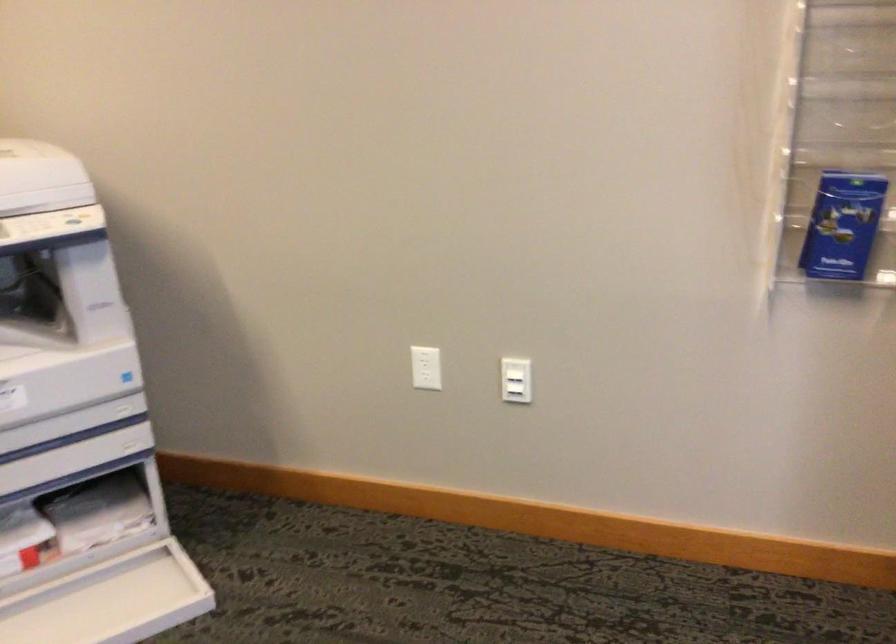
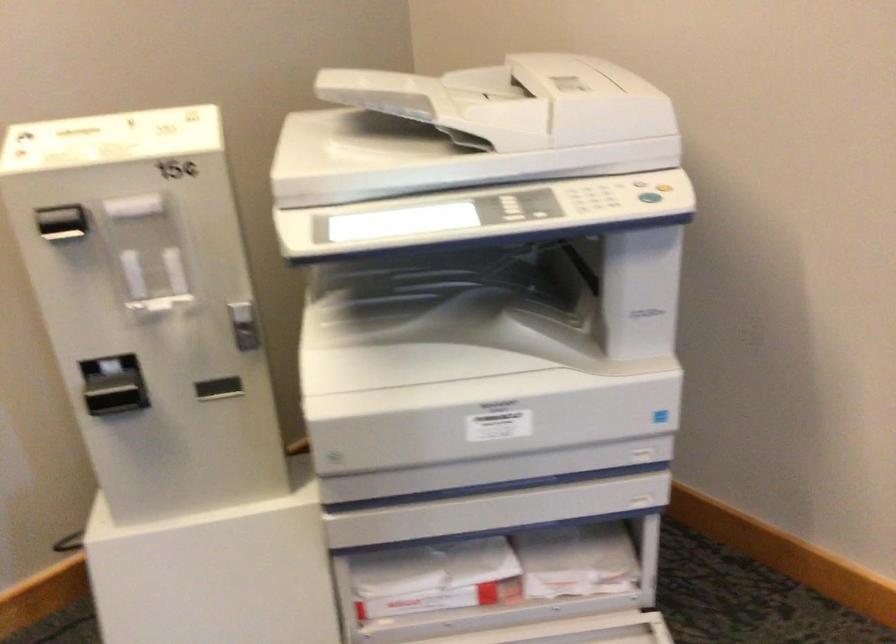
Locate, in the second image, the point that corresponds to [99,214] in the first image.

(664, 185)